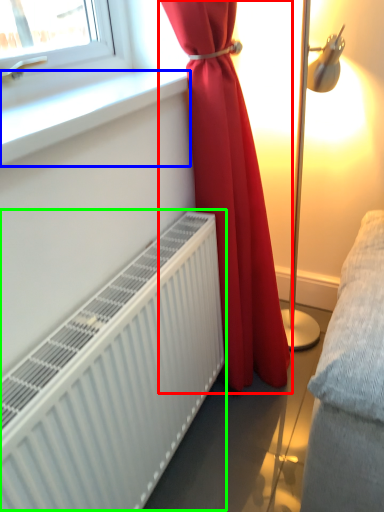
Question: Considering the real-world distances, which object is farthest from curtain (highlighted by a red box)? window sill (highlighted by a blue box) or radiator (highlighted by a green box)?

Choices:
 (A) window sill
 (B) radiator

Answer: (A)